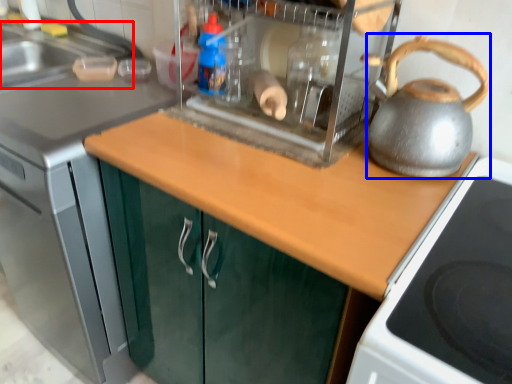
Question: Which of the following is the closest to the observer, sink (highlighted by a red box) or kettle (highlighted by a blue box)?

Choices:
 (A) sink
 (B) kettle

Answer: (B)